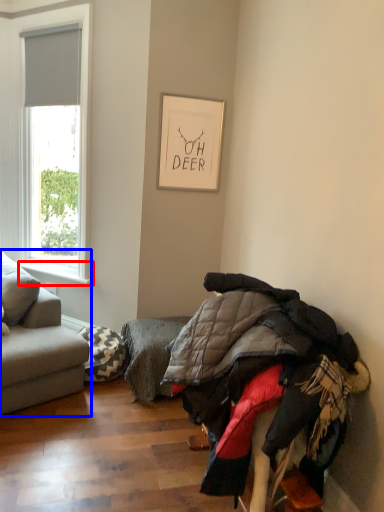
Question: Among these objects, which one is nearest to the camera, window sill (highlighted by a red box) or studio couch (highlighted by a blue box)?

Choices:
 (A) window sill
 (B) studio couch

Answer: (B)